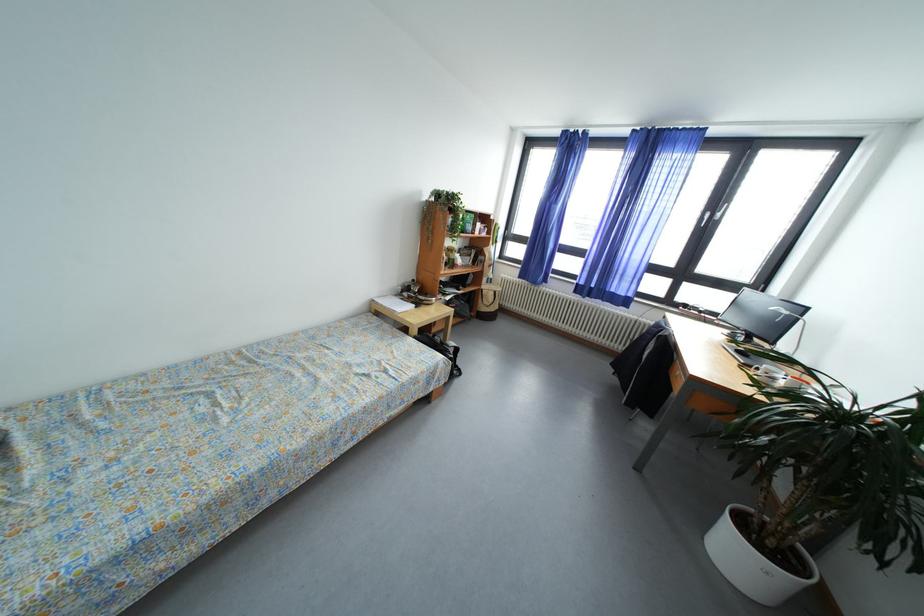
Where would you lift the white spray bottle? Please return your answer as a coordinate pair (x, y).

(477, 224)